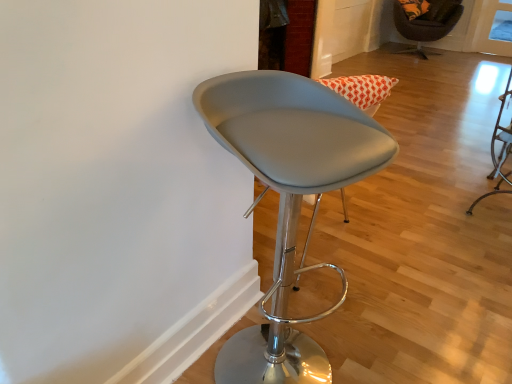
Locate an element on the screen. velvet-like brown chair at upper right, positioned as the 1th chair in back-to-front order is located at coordinates (423, 29).

In order to face velvet-like brown chair at upper right, the first chair from the right, should I rotate leftwards or rightwards?

Rotate right and turn 21.471 degrees.

What do you see at coordinates (423, 29) in the screenshot? The image size is (512, 384). I see `velvet-like brown chair at upper right, which appears as the 1th chair when viewed from the top` at bounding box center [423, 29].

The height and width of the screenshot is (384, 512). In order to click on satin gray stool at center, which ranks as the second chair in top-to-bottom order in this screenshot , I will do `click(288, 197)`.

Describe the element at coordinates (288, 197) in the screenshot. The image size is (512, 384). I see `satin gray stool at center, which ranks as the second chair in top-to-bottom order` at that location.

What is the approximate height of satin gray stool at center, which is the 2th chair from right to left?

It is 36.78 inches.

Identify the location of velvet-like brown chair at upper right, the second chair viewed from the front. (423, 29).

Based on their positions, is satin gray stool at center, which ranks as the second chair in top-to-bottom order, located to the left or right of velvet-like brown chair at upper right, which appears as the 1th chair when viewed from the top?

satin gray stool at center, which ranks as the second chair in top-to-bottom order, is positioned on velvet-like brown chair at upper right, which appears as the 1th chair when viewed from the top,'s left side.

Who is more distant, satin gray stool at center, arranged as the second chair when viewed from the back, or velvet-like brown chair at upper right, the first chair from the right?

velvet-like brown chair at upper right, the first chair from the right, is further away from the camera.

Considering the points (286, 321) and (438, 25), which point is behind, point (286, 321) or point (438, 25)?

Point (438, 25)

From the image's perspective, does satin gray stool at center, the 1th chair in the left-to-right sequence, appear lower than velvet-like brown chair at upper right, positioned as the 1th chair in back-to-front order?

Correct, satin gray stool at center, the 1th chair in the left-to-right sequence, appears lower than velvet-like brown chair at upper right, positioned as the 1th chair in back-to-front order, in the image.

From a real-world perspective, is satin gray stool at center, the 1th chair in the left-to-right sequence, above or below velvet-like brown chair at upper right, which is the 2th chair from left to right?

In terms of real-world spatial position, satin gray stool at center, the 1th chair in the left-to-right sequence, is above velvet-like brown chair at upper right, which is the 2th chair from left to right.

Considering the sizes of objects satin gray stool at center, which ranks as the second chair in top-to-bottom order, and velvet-like brown chair at upper right, marked as the second chair in a bottom-to-top arrangement, in the image provided, who is wider, satin gray stool at center, which ranks as the second chair in top-to-bottom order, or velvet-like brown chair at upper right, marked as the second chair in a bottom-to-top arrangement,?

With larger width is velvet-like brown chair at upper right, marked as the second chair in a bottom-to-top arrangement.

From their relative heights in the image, would you say satin gray stool at center, the 1th chair positioned from the front, is taller or shorter than velvet-like brown chair at upper right, which is the 2th chair from left to right?

Clearly, satin gray stool at center, the 1th chair positioned from the front, is taller compared to velvet-like brown chair at upper right, which is the 2th chair from left to right.

Considering the sizes of satin gray stool at center, arranged as the second chair when viewed from the back, and velvet-like brown chair at upper right, which appears as the 1th chair when viewed from the top, in the image, is satin gray stool at center, arranged as the second chair when viewed from the back, bigger or smaller than velvet-like brown chair at upper right, which appears as the 1th chair when viewed from the top,?

satin gray stool at center, arranged as the second chair when viewed from the back, is smaller than velvet-like brown chair at upper right, which appears as the 1th chair when viewed from the top.

Choose the correct answer: Is satin gray stool at center, which ranks as the second chair in top-to-bottom order, inside velvet-like brown chair at upper right, which is the 2th chair from left to right, or outside it?

satin gray stool at center, which ranks as the second chair in top-to-bottom order, is not inside velvet-like brown chair at upper right, which is the 2th chair from left to right, it's outside.

Does satin gray stool at center, arranged as the second chair when viewed from the back, touch velvet-like brown chair at upper right, the first chair from the right?

satin gray stool at center, arranged as the second chair when viewed from the back, and velvet-like brown chair at upper right, the first chair from the right, are not in contact.

In the scene shown: Is velvet-like brown chair at upper right, marked as the second chair in a bottom-to-top arrangement, at the back of satin gray stool at center, which is the 2th chair from right to left?

No.

What's the angular difference between satin gray stool at center, the 1th chair positioned from the front, and velvet-like brown chair at upper right, which appears as the 1th chair when viewed from the top,'s facing directions?

They differ by 59.2 degrees in their facing directions.

Measure the distance from satin gray stool at center, the 1th chair in the left-to-right sequence, to velvet-like brown chair at upper right, which is the 2th chair from left to right.

They are 4.36 meters apart.

Locate an element on the screen. The image size is (512, 384). chair in front of the velvet-like brown chair at upper right, the second chair viewed from the front is located at coordinates (288, 197).

Can you confirm if velvet-like brown chair at upper right, the second chair viewed from the front, is positioned to the right of satin gray stool at center, placed as the first chair when sorted from bottom to top?

A: Indeed, velvet-like brown chair at upper right, the second chair viewed from the front, is positioned on the right side of satin gray stool at center, placed as the first chair when sorted from bottom to top.

Considering the relative positions of velvet-like brown chair at upper right, positioned as the 1th chair in back-to-front order, and satin gray stool at center, which ranks as the second chair in top-to-bottom order, in the image provided, is velvet-like brown chair at upper right, positioned as the 1th chair in back-to-front order, in front of satin gray stool at center, which ranks as the second chair in top-to-bottom order,?

No.

Considering the positions of points (411, 50) and (294, 199), is point (411, 50) closer to camera compared to point (294, 199)?

No.

From the image's perspective, is velvet-like brown chair at upper right, positioned as the 1th chair in back-to-front order, above or below satin gray stool at center, which is the 2th chair from right to left?

From the image's perspective, velvet-like brown chair at upper right, positioned as the 1th chair in back-to-front order, appears above satin gray stool at center, which is the 2th chair from right to left.

From a real-world perspective, who is located higher, velvet-like brown chair at upper right, positioned as the 1th chair in back-to-front order, or satin gray stool at center, placed as the first chair when sorted from bottom to top?

satin gray stool at center, placed as the first chair when sorted from bottom to top, is physically above.

Between velvet-like brown chair at upper right, the second chair viewed from the front, and satin gray stool at center, which is the 2th chair from right to left, which one has smaller width?

satin gray stool at center, which is the 2th chair from right to left.

Which of these two, velvet-like brown chair at upper right, which appears as the 1th chair when viewed from the top, or satin gray stool at center, which ranks as the second chair in top-to-bottom order, stands taller?

With more height is satin gray stool at center, which ranks as the second chair in top-to-bottom order.

Based on their sizes in the image, would you say velvet-like brown chair at upper right, which appears as the 1th chair when viewed from the top, is bigger or smaller than satin gray stool at center, arranged as the second chair when viewed from the back?

Clearly, velvet-like brown chair at upper right, which appears as the 1th chair when viewed from the top, is larger in size than satin gray stool at center, arranged as the second chair when viewed from the back.

Would you say velvet-like brown chair at upper right, positioned as the 1th chair in back-to-front order, is inside or outside satin gray stool at center, arranged as the second chair when viewed from the back?

velvet-like brown chair at upper right, positioned as the 1th chair in back-to-front order, is not inside satin gray stool at center, arranged as the second chair when viewed from the back, it's outside.

Is velvet-like brown chair at upper right, the second chair viewed from the front, positioned far away from satin gray stool at center, the 1th chair in the left-to-right sequence?

Yes, velvet-like brown chair at upper right, the second chair viewed from the front, is far from satin gray stool at center, the 1th chair in the left-to-right sequence.

Is velvet-like brown chair at upper right, the second chair viewed from the front, aimed at satin gray stool at center, which is the 2th chair from right to left?

Yes, velvet-like brown chair at upper right, the second chair viewed from the front, is facing satin gray stool at center, which is the 2th chair from right to left.

I want to click on chair on the right side of satin gray stool at center, arranged as the second chair when viewed from the back, so click(423, 29).

Where is `chair behind the satin gray stool at center, which ranks as the second chair in top-to-bottom order`? The width and height of the screenshot is (512, 384). chair behind the satin gray stool at center, which ranks as the second chair in top-to-bottom order is located at coordinates (423, 29).

Locate an element on the screen. The width and height of the screenshot is (512, 384). chair in front of the velvet-like brown chair at upper right, which is the 2th chair from left to right is located at coordinates (288, 197).